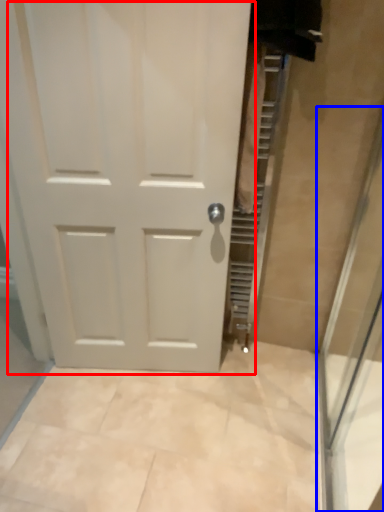
Question: Which object appears farthest to the camera in this image, door (highlighted by a red box) or shower door (highlighted by a blue box)?

Choices:
 (A) door
 (B) shower door

Answer: (A)